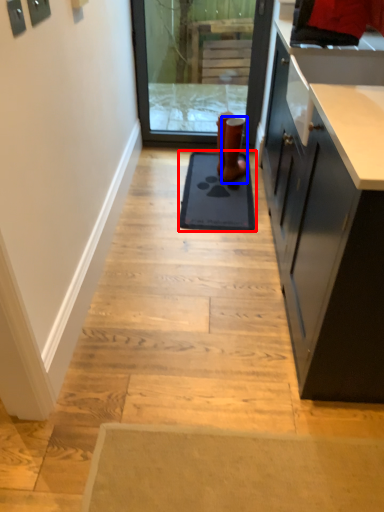
Question: Which point is further to the camera, mat (highlighted by a red box) or footwear (highlighted by a blue box)?

Choices:
 (A) mat
 (B) footwear

Answer: (B)